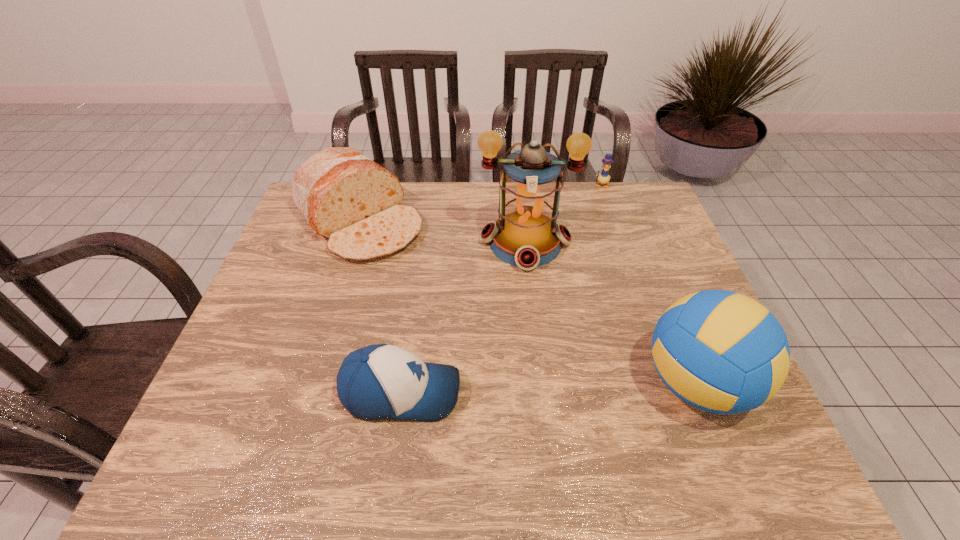
The width and height of the screenshot is (960, 540). In order to click on free space between the third object from left to right and the duckling in this screenshot , I will do `click(564, 214)`.

At what (x,y) coordinates should I click in order to perform the action: click on empty space between the duckling and the tallest object. Please return your answer as a coordinate pair (x, y). Image resolution: width=960 pixels, height=540 pixels. Looking at the image, I should click on (564, 214).

Locate an element on the screen. vacant point located between the bread and the baseball cap is located at coordinates pyautogui.click(x=380, y=307).

Locate which object is the second closest to the volleyball. Please provide its 2D coordinates. Your answer should be formatted as a tuple, i.e. [(x, y)], where the tuple contains the x and y coordinates of a point satisfying the conditions above.

[(382, 381)]

Find the location of a particular element. This screenshot has width=960, height=540. object identified as the second closest to the volleyball is located at coordinates (382, 381).